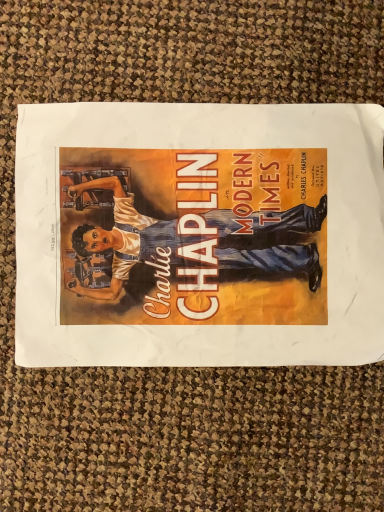
Locate an element on the screen. free space above matte paper poster at center (from a real-world perspective) is located at coordinates (194, 232).